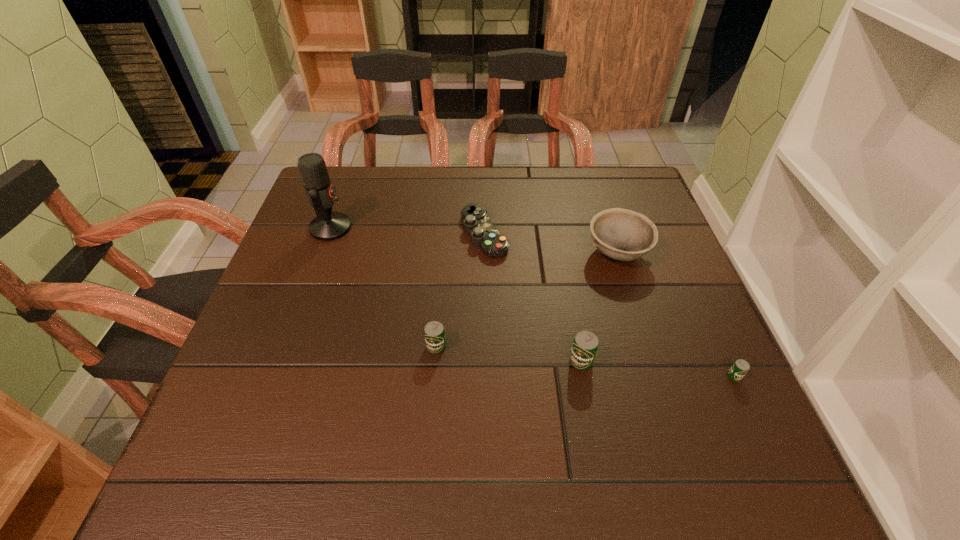
The beer cans are evenly distributed in the image. To maintain this, where would you place another beer can on the left? Please point to a free space. Please provide its 2D coordinates. Your answer should be formatted as a tuple, i.e. [(x, y)], where the tuple contains the x and y coordinates of a point satisfying the conditions above.

[(299, 333)]